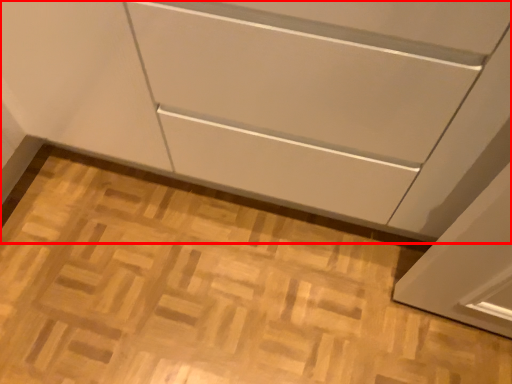
Question: In this image, where is cabinetry (annotated by the red box) located relative to plain?

Choices:
 (A) right
 (B) left

Answer: (B)